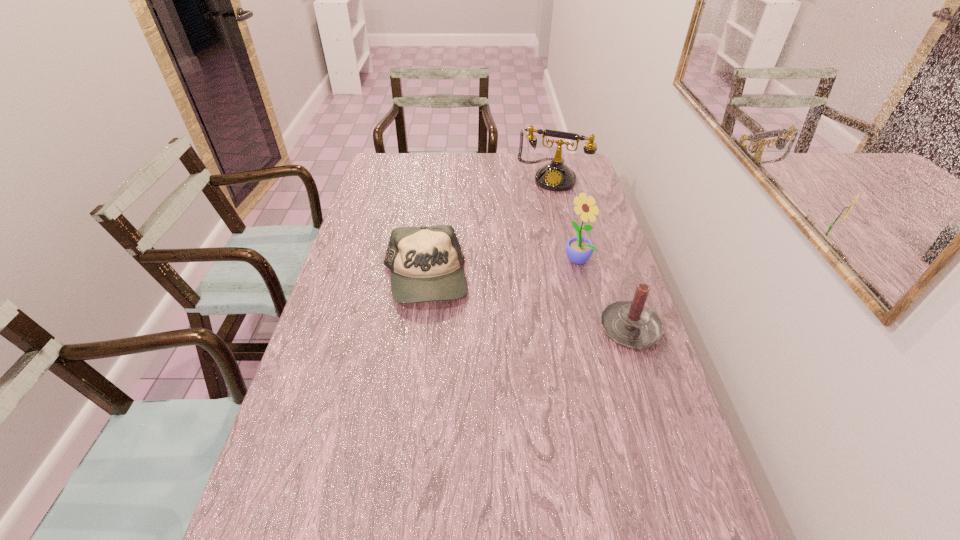
In order to click on free space located on the dial of the third shortest object in this screenshot , I will do `click(531, 220)`.

Identify the location of free location located on the front-facing side of the sunflower. (536, 288).

The height and width of the screenshot is (540, 960). In order to click on vacant space situated 0.220m on the front-facing side of the sunflower in this screenshot , I will do `click(518, 299)`.

Where is `vacant space situated 0.300m on the front-facing side of the sunflower`? The image size is (960, 540). vacant space situated 0.300m on the front-facing side of the sunflower is located at coordinates (x=498, y=312).

Identify the location of object positioned at the far edge. This screenshot has height=540, width=960. (555, 176).

Identify the location of object located in the left edge section of the desktop. The height and width of the screenshot is (540, 960). (426, 263).

Where is `candle that is at the right edge`? candle that is at the right edge is located at coordinates (631, 324).

At what (x,y) coordinates should I click in order to perform the action: click on telephone positioned at the right edge. Please return your answer as a coordinate pair (x, y). This screenshot has height=540, width=960. Looking at the image, I should click on (555, 176).

This screenshot has height=540, width=960. I want to click on sunflower located in the right edge section of the desktop, so click(579, 250).

This screenshot has height=540, width=960. What are the coordinates of `object at the far right corner` in the screenshot? It's located at (555, 176).